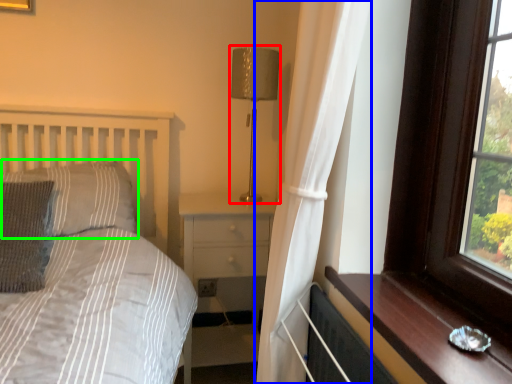
Question: Which object is positioned closest to table lamp (highlighted by a red box)? Select from curtain (highlighted by a blue box) and pillow (highlighted by a green box).

Choices:
 (A) curtain
 (B) pillow

Answer: (A)